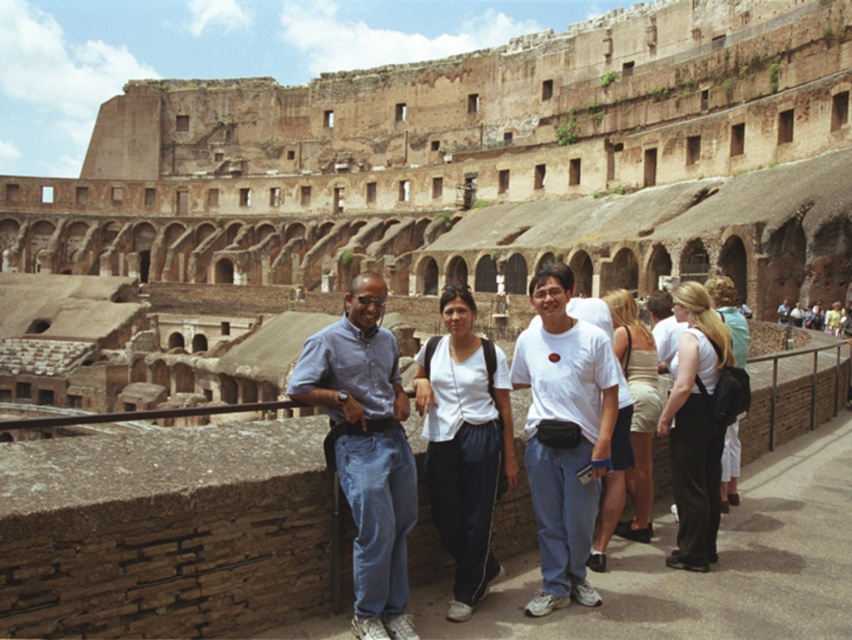
Between blue denim jeans at center and beige fabric skirt at center, which one appears on the left side from the viewer's perspective?

blue denim jeans at center is more to the left.

Between blue denim jeans at center and beige fabric skirt at center, which one is positioned lower?

Positioned lower is beige fabric skirt at center.

At what (x,y) coordinates should I click in order to perform the action: click on blue denim jeans at center. Please return your answer as a coordinate pair (x, y). The image size is (852, 640). Looking at the image, I should click on (366, 449).

Identify the location of blue denim jeans at center. pyautogui.click(x=366, y=449).

Can you confirm if white fabric pants at center is wider than beige fabric skirt at center?

No.

Does white fabric pants at center appear on the left side of beige fabric skirt at center?

Correct, you'll find white fabric pants at center to the left of beige fabric skirt at center.

Is point (471, 369) behind point (635, 339)?

That is False.

Where is `white fabric pants at center`? The height and width of the screenshot is (640, 852). white fabric pants at center is located at coordinates (464, 442).

Who is lower down, white fabric pants at center or white cotton shirt at center?

white fabric pants at center

The image size is (852, 640). What do you see at coordinates (464, 442) in the screenshot? I see `white fabric pants at center` at bounding box center [464, 442].

What do you see at coordinates (464, 442) in the screenshot? The image size is (852, 640). I see `white fabric pants at center` at bounding box center [464, 442].

Where is `white fabric pants at center`? The image size is (852, 640). white fabric pants at center is located at coordinates (464, 442).